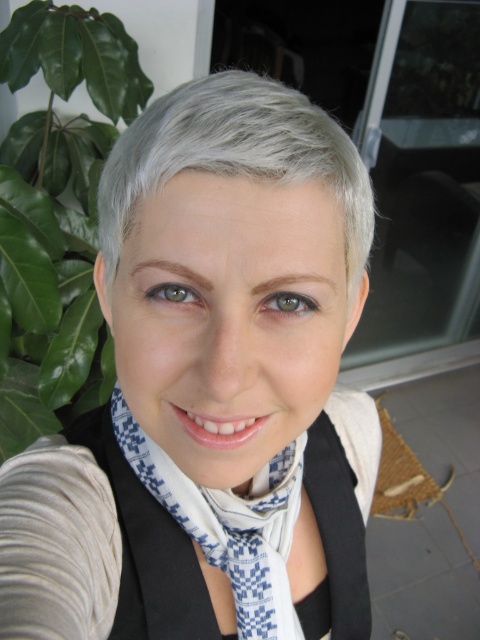
Question: Which of the following is the farthest from the observer?

Choices:
 (A) white checkered scarf at center
 (B) white matte scarf at center

Answer: (A)

Question: Is white matte scarf at center bigger than white checkered scarf at center?

Choices:
 (A) no
 (B) yes

Answer: (B)

Question: Which point is farther from the camera taking this photo?

Choices:
 (A) 227,582
 (B) 171,112

Answer: (A)

Question: Can you confirm if gray matte hair at upper center is positioned below white checkered scarf at center?

Choices:
 (A) yes
 (B) no

Answer: (B)

Question: Is white matte scarf at center positioned at the back of gray matte hair at upper center?

Choices:
 (A) yes
 (B) no

Answer: (B)

Question: Estimate the real-world distances between objects in this image. Which object is farther from the gray matte hair at upper center?

Choices:
 (A) white matte scarf at center
 (B) white checkered scarf at center

Answer: (B)